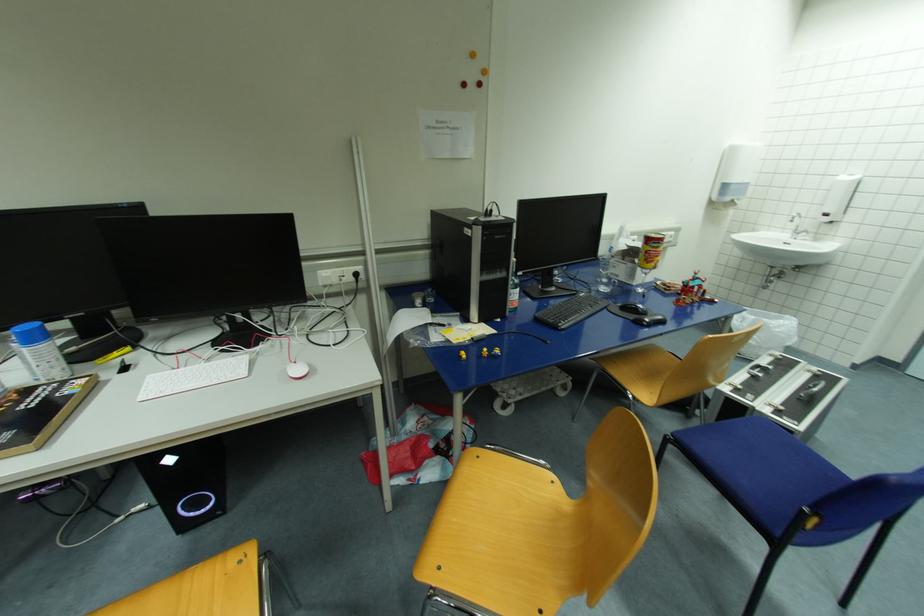
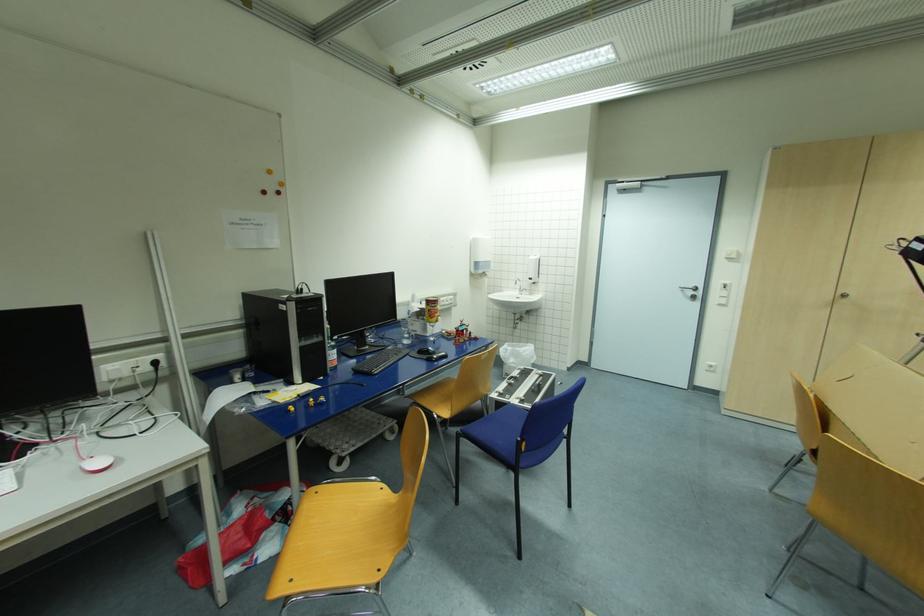
Where in the second image is the point corresponding to point 829,215 from the first image?

(533, 280)